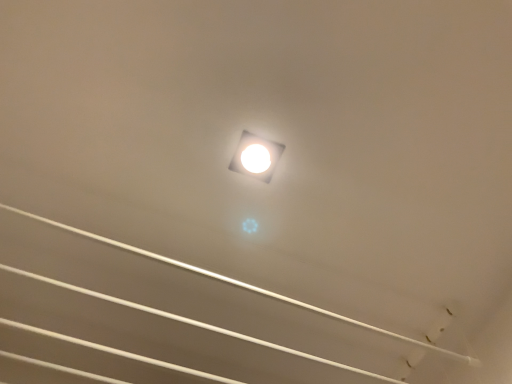
Question: Is white glossy ceiling at center far from white glossy square at center?

Choices:
 (A) no
 (B) yes

Answer: (A)

Question: Is white glossy ceiling at center outside white glossy square at center?

Choices:
 (A) yes
 (B) no

Answer: (A)

Question: Does white glossy ceiling at center lie in front of white glossy square at center?

Choices:
 (A) no
 (B) yes

Answer: (B)

Question: Is white glossy ceiling at center shorter than white glossy square at center?

Choices:
 (A) no
 (B) yes

Answer: (A)

Question: Is white glossy ceiling at center aimed at white glossy square at center?

Choices:
 (A) yes
 (B) no

Answer: (A)

Question: From a real-world perspective, is white glossy ceiling at center beneath white glossy square at center?

Choices:
 (A) yes
 (B) no

Answer: (A)

Question: From a real-world perspective, is white glossy square at center on white glossy ceiling at center?

Choices:
 (A) yes
 (B) no

Answer: (A)

Question: Is white glossy square at center far from white glossy ceiling at center?

Choices:
 (A) no
 (B) yes

Answer: (A)

Question: Is white glossy square at center positioned behind white glossy ceiling at center?

Choices:
 (A) yes
 (B) no

Answer: (A)

Question: Can you confirm if white glossy square at center is bigger than white glossy ceiling at center?

Choices:
 (A) no
 (B) yes

Answer: (A)

Question: From the image's perspective, is white glossy square at center on top of white glossy ceiling at center?

Choices:
 (A) no
 (B) yes

Answer: (B)

Question: Could you tell me if white glossy square at center is facing white glossy ceiling at center?

Choices:
 (A) no
 (B) yes

Answer: (A)

Question: Considering their positions, is white glossy square at center located in front of or behind white glossy ceiling at center?

Choices:
 (A) behind
 (B) front

Answer: (A)